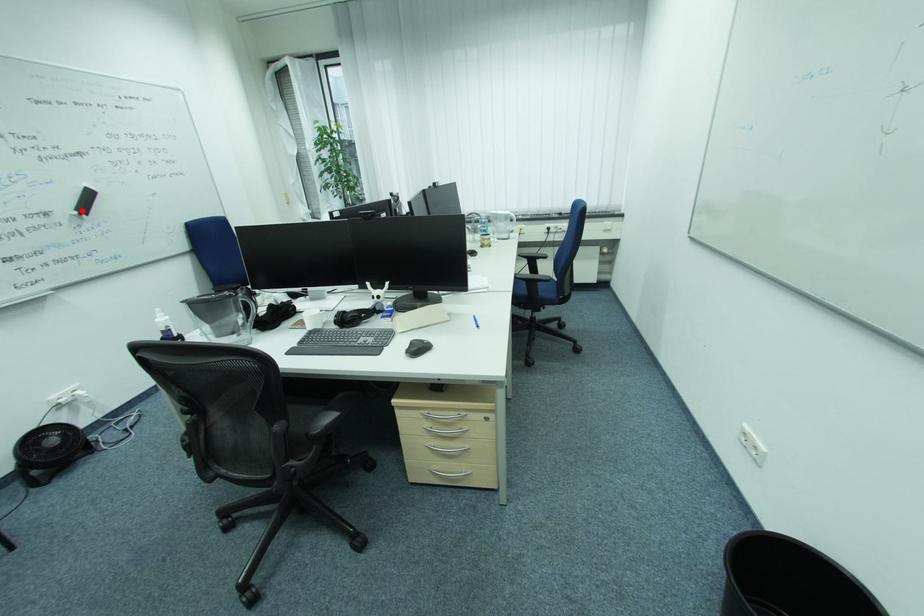
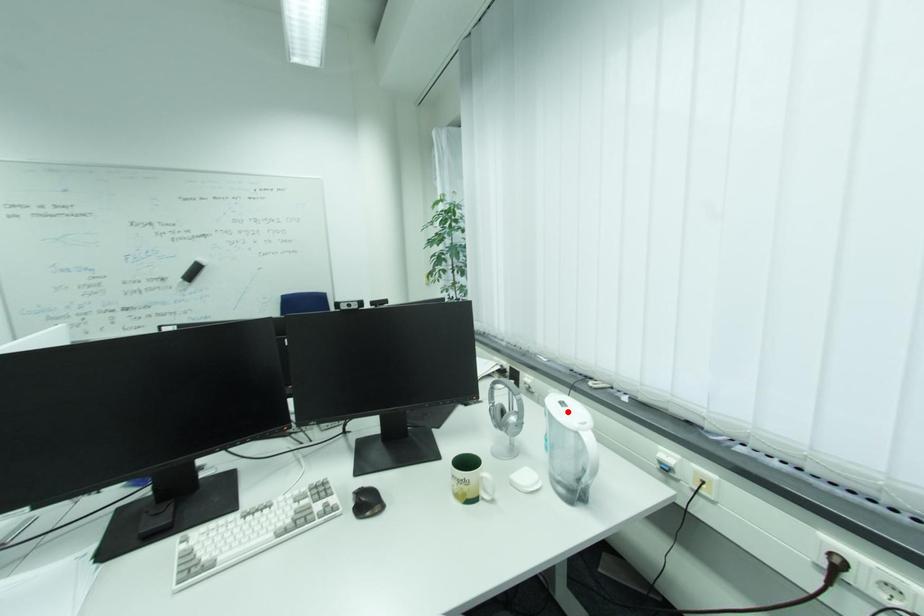
I am providing you with two images of the same scene from different viewpoints. A red point is marked on the first image and another point is marked on the second image. Do the highlighted points in image1 and image2 indicate the same real-world spot?

No